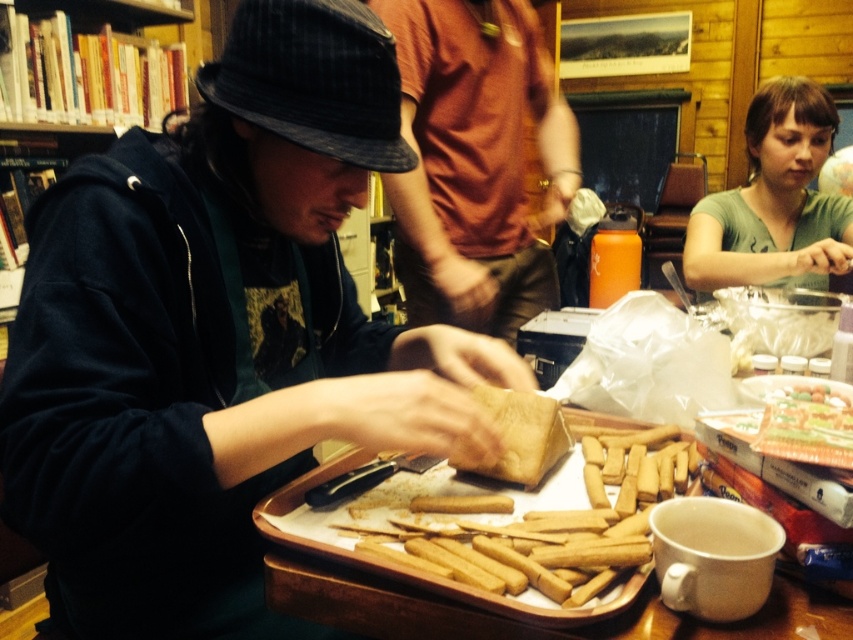
Question: Which point is closer to the camera taking this photo?

Choices:
 (A) (485, 131)
 (B) (260, 512)
 (C) (468, 490)
 (D) (451, 460)

Answer: (B)

Question: Is matte orange shirt at center to the right of smooth brown breadsticks at center from the viewer's perspective?

Choices:
 (A) no
 (B) yes

Answer: (A)

Question: Does matte orange shirt at center appear under smooth brown breadsticks at center?

Choices:
 (A) yes
 (B) no

Answer: (B)

Question: Which object is farther from the camera taking this photo?

Choices:
 (A) golden brown bread at center
 (B) matte orange shirt at center

Answer: (B)

Question: Does wooden tray at center appear under smooth brown breadsticks at center?

Choices:
 (A) no
 (B) yes

Answer: (B)

Question: Which object is farther from the camera taking this photo?

Choices:
 (A) wooden tray at center
 (B) matte orange shirt at center
 (C) golden brown bread at center
 (D) brown matte bread at center

Answer: (B)